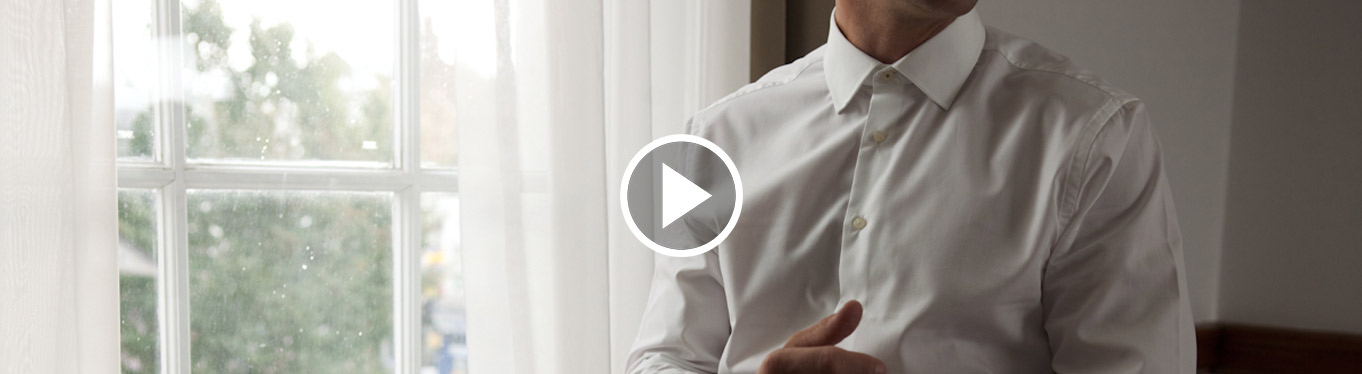
I want to click on white wall on photo, so click(1177, 77).